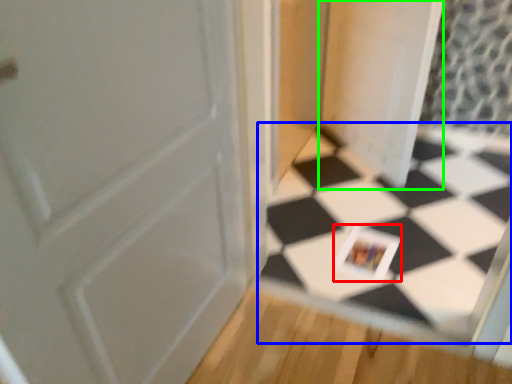
Question: Which is nearer to the postcard (highlighted by a red box)? square (highlighted by a blue box) or screen door (highlighted by a green box).

Choices:
 (A) square
 (B) screen door

Answer: (A)